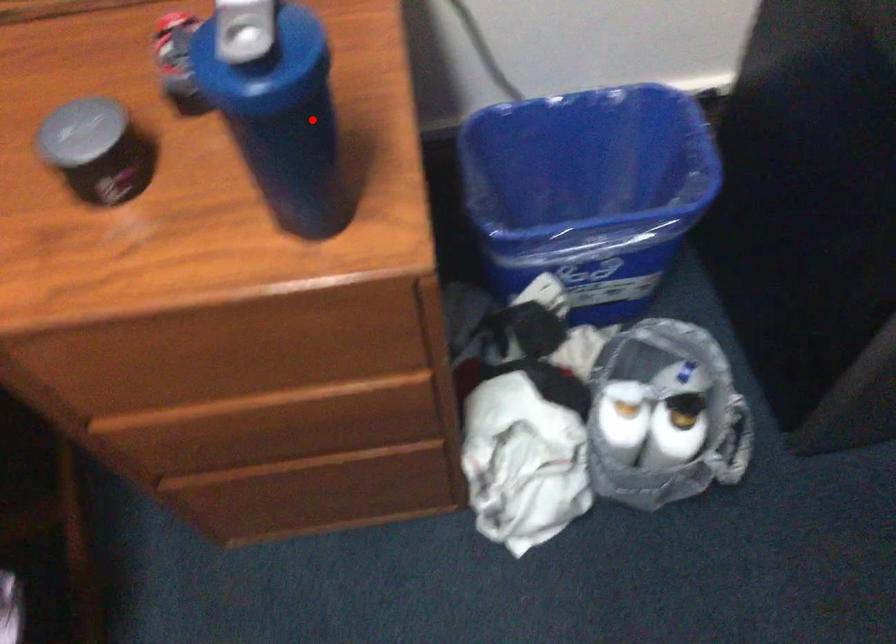
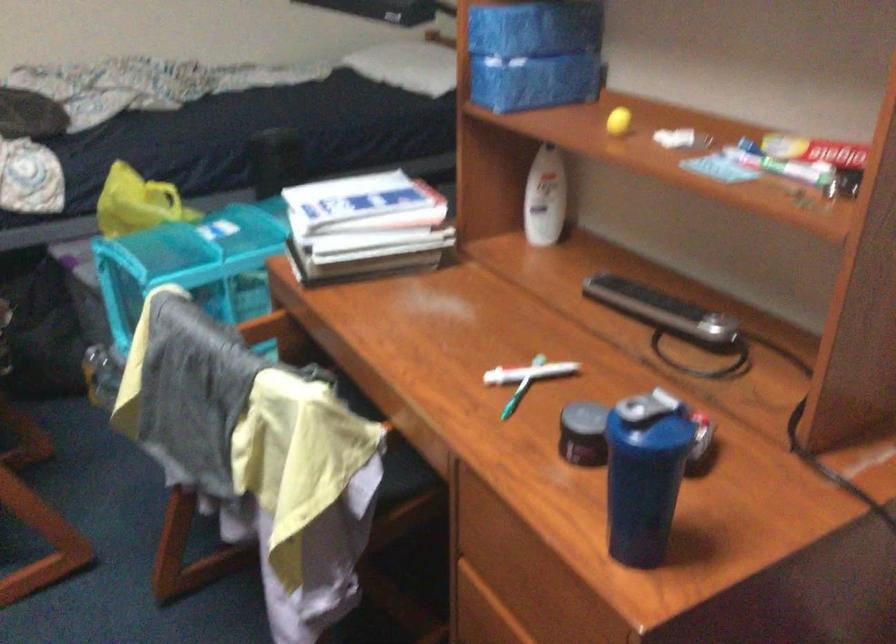
The point at the highlighted location is marked in the first image. Where is the corresponding point in the second image?

(644, 474)